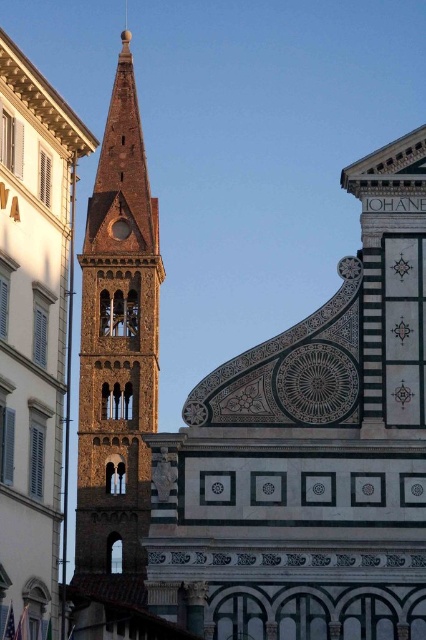
You are an architect examining the historic building. You notice two towers labeled as brown stone tower at center and brown textured tower at center. Which one is positioned lower in the image?

The brown stone tower at center is positioned lower than the brown textured tower at center, as it is described to be below it.

You are an architect examining the historic building. You notice two towers in the image. Which tower is smaller in size between the brown stone tower at center and the brown textured tower at center?

The brown stone tower at center is smaller in size compared to the brown textured tower at center.

You are standing at the entrance of the historic building and want to locate the brown stone tower at center. According to the coordinates provided, where should you look relative to your current position?

The brown stone tower at center is located at coordinates point (34, 333), so you should look slightly to the right and slightly downward from your current position.